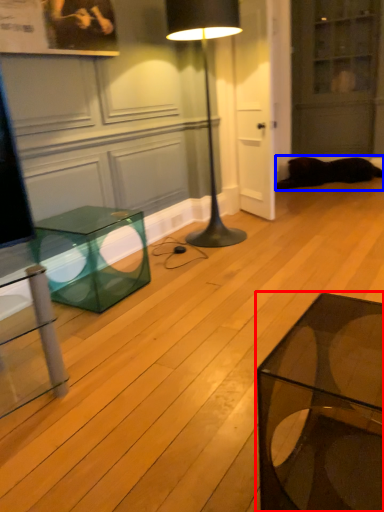
Question: Which object is further to the camera taking this photo, coffee table (highlighted by a red box) or cat (highlighted by a blue box)?

Choices:
 (A) coffee table
 (B) cat

Answer: (B)